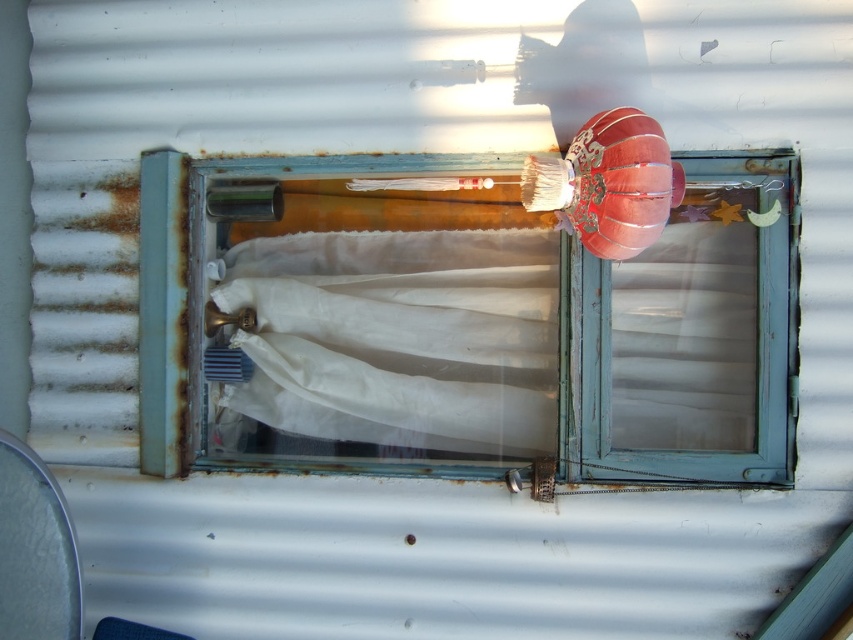
Is blue painted wood at center closer to camera compared to velvet red paper lantern at upper right?

No, it is behind velvet red paper lantern at upper right.

Find the location of a particular element. blue painted wood at center is located at coordinates (456, 332).

Which of these two, white sheer cloth at center or velvet red paper lantern at upper right, stands taller?

white sheer cloth at center

Measure the distance between point (552, 298) and camera.

9.81 feet

Describe the element at coordinates (399, 337) in the screenshot. This screenshot has width=853, height=640. I see `white sheer cloth at center` at that location.

You are a GUI agent. You are given a task and a screenshot of the screen. Output one action in this format:
    pyautogui.click(x=<x>, y=<y>)
    Task: Click on the white sheer cloth at center
    
    Given the screenshot: What is the action you would take?
    pyautogui.click(x=399, y=337)

Consider the image. Is blue painted wood at center taller than white sheer cloth at center?

Correct, blue painted wood at center is much taller as white sheer cloth at center.

Which is behind, point (486, 237) or point (390, 444)?

The point (486, 237) is more distant.

At what (x,y) coordinates should I click in order to perform the action: click on blue painted wood at center. Please return your answer as a coordinate pair (x, y). Looking at the image, I should click on (456, 332).